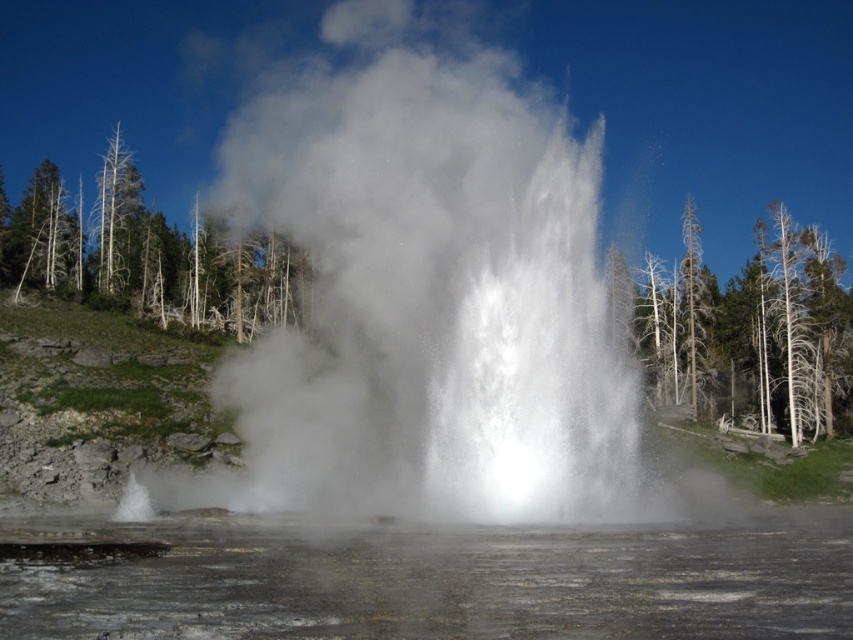
Question: Which object is closer to the camera taking this photo?

Choices:
 (A) translucent steam at center
 (B) dead wood trees at right
 (C) green leafy trees at left

Answer: (A)

Question: Which point is farther to the camera?

Choices:
 (A) dead wood tree at left
 (B) translucent steam at center
 (C) green leafy trees at left

Answer: (A)

Question: Observing the image, what is the correct spatial positioning of dead wood trees at right in reference to green leafy trees at left?

Choices:
 (A) right
 (B) left

Answer: (A)

Question: Is translucent steam at center wider than dead wood trees at right?

Choices:
 (A) no
 (B) yes

Answer: (A)

Question: Is dead wood trees at right thinner than dead wood tree at left?

Choices:
 (A) yes
 (B) no

Answer: (B)

Question: Which point is closer to the camera taking this photo?

Choices:
 (A) (109, 234)
 (B) (317, 554)

Answer: (B)